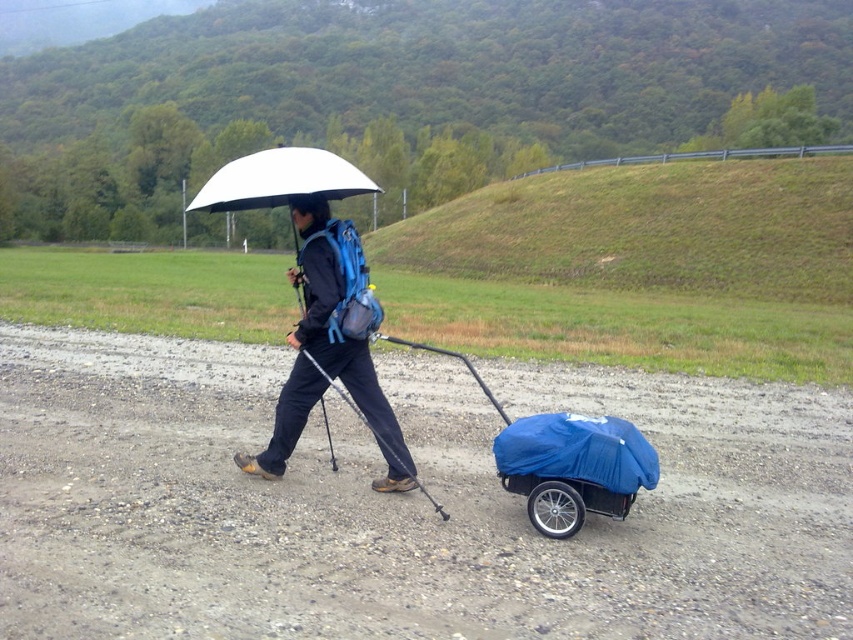
Question: Which of the following is the farthest from the observer?

Choices:
 (A) white matte umbrella at upper center
 (B) blue fabric cart at center

Answer: (A)

Question: Among these objects, which one is nearest to the camera?

Choices:
 (A) dirt gravel at center
 (B) blue fabric cart at center
 (C) matte black jacket at center
 (D) white matte umbrella at upper center

Answer: (A)

Question: Where is dirt gravel at center located in relation to blue fabric cart at center in the image?

Choices:
 (A) above
 (B) below

Answer: (A)

Question: Is matte black jacket at center positioned behind white matte umbrella at upper center?

Choices:
 (A) no
 (B) yes

Answer: (B)

Question: Observing the image, what is the correct spatial positioning of blue fabric cart at center in reference to white matte umbrella at upper center?

Choices:
 (A) left
 (B) right

Answer: (B)

Question: Which point appears closest to the camera in this image?

Choices:
 (A) (589, 497)
 (B) (289, 392)

Answer: (A)